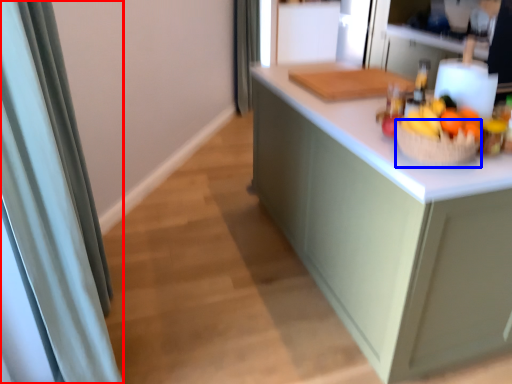
Question: Which of the following is the farthest to the observer, shower curtain (highlighted by a red box) or basket (highlighted by a blue box)?

Choices:
 (A) shower curtain
 (B) basket

Answer: (B)